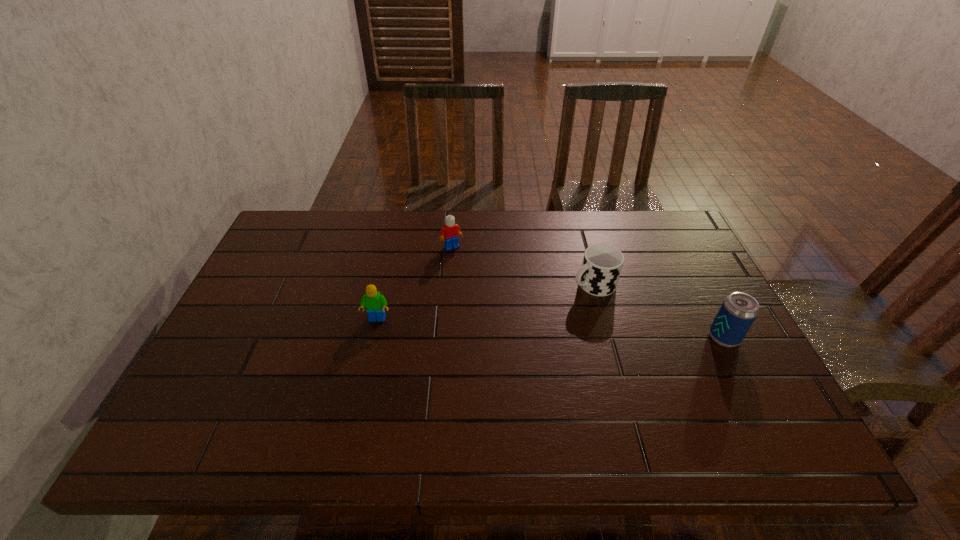
You are a GUI agent. You are given a task and a screenshot of the screen. Output one action in this format:
    pyautogui.click(x=<x>, y=<y>)
    Task: Click on the vacant space at the left edge of the desktop
    
    Given the screenshot: What is the action you would take?
    pyautogui.click(x=253, y=318)

The height and width of the screenshot is (540, 960). In the image, there is a desktop. Identify the location of vacant space at the right edge. (727, 368).

Identify the location of free location at the far left corner. The width and height of the screenshot is (960, 540). (310, 230).

Where is `free space at the near left corner of the desktop`? free space at the near left corner of the desktop is located at coordinates (184, 401).

At what (x,y) coordinates should I click in order to perform the action: click on vacant space at the far right corner of the desktop. Please return your answer as a coordinate pair (x, y). The height and width of the screenshot is (540, 960). Looking at the image, I should click on (648, 252).

Where is `unoccupied position between the second nearest object and the farthest object`? unoccupied position between the second nearest object and the farthest object is located at coordinates (415, 283).

Find the location of a particular element. vacant region between the nearer Lego and the right Lego is located at coordinates (415, 283).

In order to click on empty space between the third object from right to left and the left Lego in this screenshot , I will do `click(415, 283)`.

At what (x,y) coordinates should I click in order to perform the action: click on unoccupied area between the left Lego and the right Lego. Please return your answer as a coordinate pair (x, y). Looking at the image, I should click on (415, 283).

Locate an element on the screen. This screenshot has width=960, height=540. unoccupied position between the third nearest object and the left Lego is located at coordinates (485, 302).